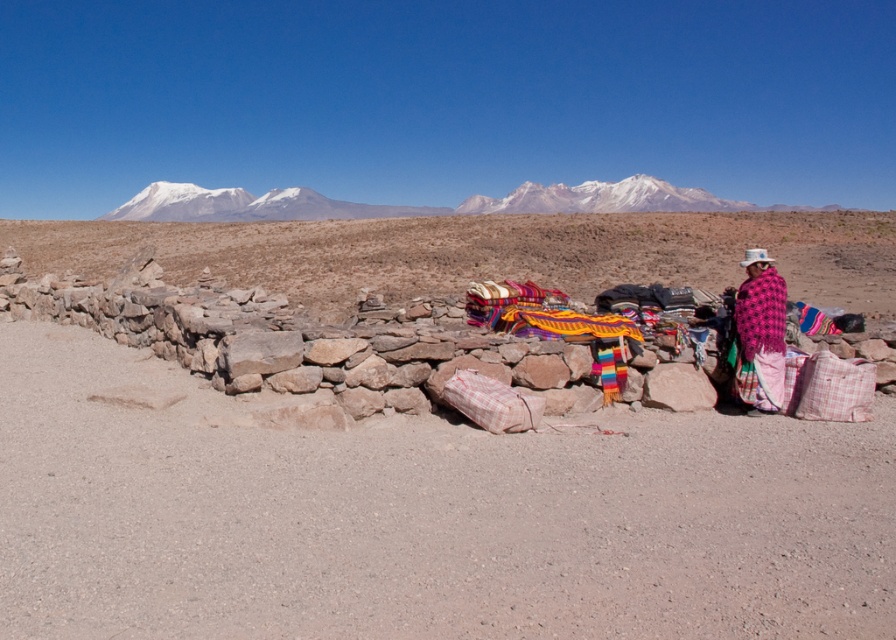
Question: In this image, where is white snow-covered mountain at upper center located relative to pink woven shawl at right?

Choices:
 (A) right
 (B) left

Answer: (B)

Question: Which point is closer to the camera?

Choices:
 (A) (541, 195)
 (B) (304, 205)
 (C) (412, 250)
 (D) (755, 368)

Answer: (D)

Question: Which point is farther from the camera taking this photo?

Choices:
 (A) pos(179,204)
 (B) pos(520,204)
 (C) pos(312,534)
 (D) pos(751,356)

Answer: (A)

Question: Does desert sand at center appear on the right side of pink woven shawl at right?

Choices:
 (A) no
 (B) yes

Answer: (A)

Question: Does white snow-covered mountain at center appear under pink woven shawl at right?

Choices:
 (A) yes
 (B) no

Answer: (B)

Question: Which object appears closest to the camera in this image?

Choices:
 (A) pink woven shawl at right
 (B) white snow-covered mountain at upper center
 (C) white snow-covered mountain at center
 (D) desert sand at center

Answer: (D)